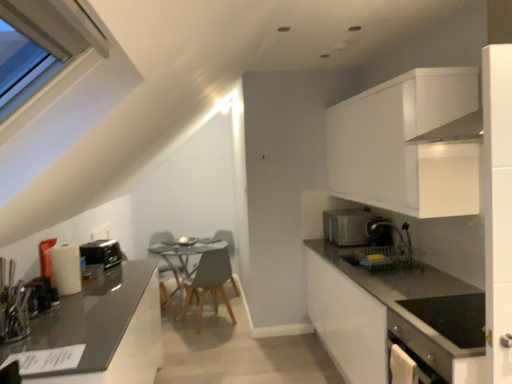
Image resolution: width=512 pixels, height=384 pixels. Describe the element at coordinates (347, 226) in the screenshot. I see `satin silver toaster at upper right` at that location.

Find the location of a particular element. white matte cabinet at upper right is located at coordinates (409, 144).

In order to face black plastic toaster at left, which is counted as the first appliance, starting from the back, should I rotate leftwards or rightwards?

Turn left by 19.841 degrees to look at black plastic toaster at left, which is counted as the first appliance, starting from the back.

Locate an element on the screen. The width and height of the screenshot is (512, 384). matte gray chair at center is located at coordinates (225, 238).

Locate an element on the screen. shiny dark gray countertop at left, which appears as the second countertop when viewed from the right is located at coordinates (104, 329).

What do you see at coordinates (187, 255) in the screenshot? Image resolution: width=512 pixels, height=384 pixels. I see `transparent glass table at center` at bounding box center [187, 255].

What are the coordinates of `satin silver toaster at upper right` in the screenshot? It's located at (347, 226).

Does point (177, 253) lie behind point (359, 208)?

Yes, point (177, 253) is farther from viewer.

Is transparent glass table at center aimed at satin silver toaster at upper right?

No, transparent glass table at center is not oriented towards satin silver toaster at upper right.

Does transparent glass table at center have a larger size compared to satin silver toaster at upper right?

Correct, transparent glass table at center is larger in size than satin silver toaster at upper right.

What's the angular difference between transparent glass table at center and satin silver toaster at upper right's facing directions?

93.2 degrees.

Can you confirm if white matte cabinet at upper right is thinner than satin black coffee machine at right?

Incorrect, the width of white matte cabinet at upper right is not less than that of satin black coffee machine at right.

Are white matte cabinet at upper right and satin black coffee machine at right beside each other?

No, white matte cabinet at upper right is not next to satin black coffee machine at right.

This screenshot has height=384, width=512. I want to click on cabinetry in front of the satin black coffee machine at right, so click(409, 144).

Considering the sizes of objects white matte cabinet at upper right and satin black coffee machine at right in the image provided, who is smaller, white matte cabinet at upper right or satin black coffee machine at right?

satin black coffee machine at right is smaller.

Choose the correct answer: Is metallic silver toaster at left, which is the 2th appliance from back to front, inside matte gray countertop at right, which is the 2th countertop from left to right, or outside it?

The correct answer is: outside.

Is point (41, 300) positioned after point (408, 306)?

Yes, point (41, 300) is behind point (408, 306).

Between black plastic toaster at left, which is counted as the first appliance, starting from the back, and shiny dark gray countertop at left, which appears as the second countertop when viewed from the right, which one appears on the left side from the viewer's perspective?

black plastic toaster at left, which is counted as the first appliance, starting from the back.

From a real-world perspective, is black plastic toaster at left, which is counted as the first appliance, starting from the back, on shiny dark gray countertop at left, which appears as the second countertop when viewed from the right?

Indeed, from a real-world perspective, black plastic toaster at left, which is counted as the first appliance, starting from the back, stands above shiny dark gray countertop at left, which appears as the second countertop when viewed from the right.

Where is `appliance that is the 2nd object located behind the shiny dark gray countertop at left, which ranks as the first countertop in left-to-right order`? appliance that is the 2nd object located behind the shiny dark gray countertop at left, which ranks as the first countertop in left-to-right order is located at coordinates tap(102, 253).

Does black plastic toaster at left, which is counted as the first appliance, starting from the back, have a smaller size compared to shiny dark gray countertop at left, which ranks as the first countertop in left-to-right order?

Correct, black plastic toaster at left, which is counted as the first appliance, starting from the back, occupies less space than shiny dark gray countertop at left, which ranks as the first countertop in left-to-right order.

Who is bigger, transparent glass table at center or shiny dark gray countertop at left, which appears as the second countertop when viewed from the right?

shiny dark gray countertop at left, which appears as the second countertop when viewed from the right, is bigger.

Between transparent glass table at center and shiny dark gray countertop at left, which ranks as the first countertop in left-to-right order, which one appears on the left side from the viewer's perspective?

Positioned to the left is shiny dark gray countertop at left, which ranks as the first countertop in left-to-right order.

Image resolution: width=512 pixels, height=384 pixels. What are the coordinates of `table located behind the shiny dark gray countertop at left, which appears as the second countertop when viewed from the right` in the screenshot? It's located at (187, 255).

Which object is more forward, transparent glass table at center or shiny dark gray countertop at left, which ranks as the first countertop in left-to-right order?

shiny dark gray countertop at left, which ranks as the first countertop in left-to-right order, is more forward.

Is satin black coffee machine at right spatially inside transparent glass table at center, or outside of it?

satin black coffee machine at right is located beyond the bounds of transparent glass table at center.

Is point (370, 236) positioned behind point (183, 269)?

No, (370, 236) is in front of (183, 269).

From a real-world perspective, who is located higher, satin black coffee machine at right or transparent glass table at center?

satin black coffee machine at right.

From their relative heights in the image, would you say satin black coffee machine at right is taller or shorter than transparent glass table at center?

Considering their sizes, satin black coffee machine at right has less height than transparent glass table at center.

Is the position of matte gray countertop at right, which is the 2th countertop from left to right, more distant than that of wooden chair at center?

No, matte gray countertop at right, which is the 2th countertop from left to right, is in front of wooden chair at center.

Is matte gray countertop at right, marked as the 1th countertop in a right-to-left arrangement, inside the boundaries of wooden chair at center, or outside?

matte gray countertop at right, marked as the 1th countertop in a right-to-left arrangement, is located beyond the bounds of wooden chair at center.

How distant is matte gray countertop at right, which is the 2th countertop from left to right, from wooden chair at center?

matte gray countertop at right, which is the 2th countertop from left to right, and wooden chair at center are 1.88 meters apart.

From the picture: From the image's perspective, which one is positioned higher, matte gray countertop at right, which is the 2th countertop from left to right, or wooden chair at center?

From the image's view, wooden chair at center is above.

The width and height of the screenshot is (512, 384). Identify the location of kitchen appliance on the right of the transparent glass table at center. (347, 226).

Identify the location of cabinetry above the satin black coffee machine at right (from the image's perspective). This screenshot has height=384, width=512. (409, 144).

Looking at the image, which one is located further to wooden chair at center, metallic silver toaster at left, acting as the 1th appliance starting from the front, or transparent glass table at center?

Among the two, metallic silver toaster at left, acting as the 1th appliance starting from the front, is located further to wooden chair at center.

Based on the photo, from the image, which object appears to be nearer to transparent glass table at center, matte gray chair at center or satin black coffee machine at right?

matte gray chair at center is positioned closer to the anchor transparent glass table at center.

When comparing their distances from satin black coffee machine at right, does shiny dark gray countertop at left, which ranks as the first countertop in left-to-right order, or wooden chair at center seem closer?

wooden chair at center lies closer to satin black coffee machine at right than the other object.

Estimate the real-world distances between objects in this image. Which object is further from matte gray chair at center, shiny dark gray countertop at left, which ranks as the first countertop in left-to-right order, or satin black coffee machine at right?

Based on the image, shiny dark gray countertop at left, which ranks as the first countertop in left-to-right order, appears to be further to matte gray chair at center.

Estimate the real-world distances between objects in this image. Which object is further from metallic silver toaster at left, which is the 2th appliance from back to front, shiny dark gray countertop at left, which appears as the second countertop when viewed from the right, or white matte cabinet at upper right?

white matte cabinet at upper right is positioned further to the anchor metallic silver toaster at left, which is the 2th appliance from back to front.

Considering their positions, is black plastic toaster at left, which is counted as the 2th appliance, starting from the front, positioned closer to white matte cabinet at upper right than wooden chair at center?

black plastic toaster at left, which is counted as the 2th appliance, starting from the front, is closer to white matte cabinet at upper right.

When comparing their distances from satin black coffee machine at right, does satin silver toaster at upper right or matte gray countertop at right, marked as the 1th countertop in a right-to-left arrangement, seem further?

Based on the image, matte gray countertop at right, marked as the 1th countertop in a right-to-left arrangement, appears to be further to satin black coffee machine at right.

Looking at the image, which one is located closer to wooden chair at center, matte gray chair at center or satin silver toaster at upper right?

The object closer to wooden chair at center is matte gray chair at center.

Identify the location of cabinetry between shiny dark gray countertop at left, which ranks as the first countertop in left-to-right order, and transparent glass table at center, along the z-axis. (409, 144).

This screenshot has height=384, width=512. I want to click on appliance situated between black plastic toaster at left, which is counted as the first appliance, starting from the back, and satin black coffee machine at right from left to right, so click(x=41, y=296).

You are a GUI agent. You are given a task and a screenshot of the screen. Output one action in this format:
    pyautogui.click(x=<x>, y=<y>)
    Task: Click on the chair located between black plastic toaster at left, which is counted as the first appliance, starting from the back, and white matte cabinet at upper right in the left-right direction
    
    Given the screenshot: What is the action you would take?
    pyautogui.click(x=210, y=282)

Where is `chair located between shiny dark gray countertop at left, which ranks as the first countertop in left-to-right order, and matte gray chair at center in the depth direction`? chair located between shiny dark gray countertop at left, which ranks as the first countertop in left-to-right order, and matte gray chair at center in the depth direction is located at coordinates (x=210, y=282).